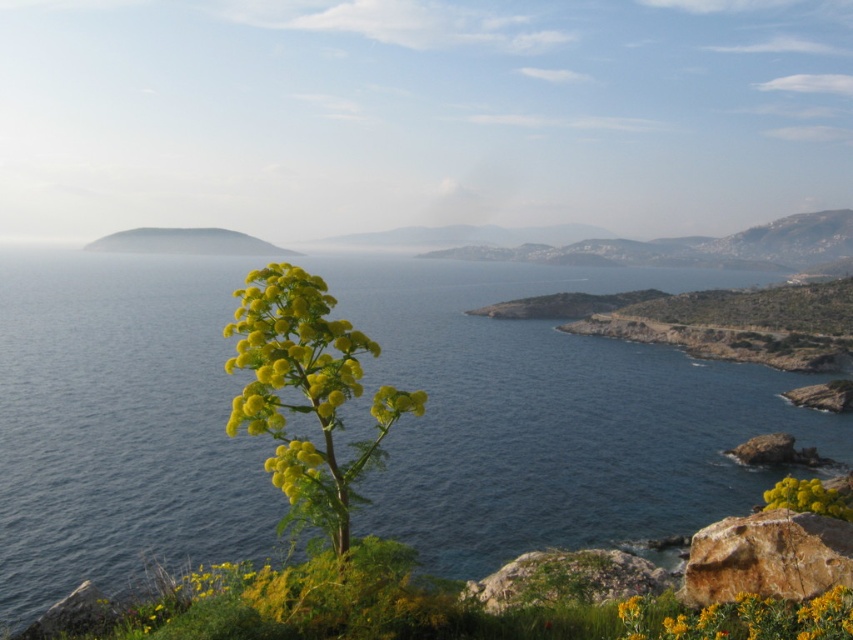
You are a botanist examining the coastal landscape. You need to determine which object occupies more space in the image between the yellow fluffy plant at center and the brown rough rock at lower right. Based on their sizes, which one would you say is larger?

The yellow fluffy plant at center is bigger than the brown rough rock at lower right, so the yellow fluffy plant at center occupies more space in the image.

You are planning to place a small garden statue between the brown rough rock at lower right and the yellow matte flower at lower right in the coastal landscape. The statue requires a minimum of 12 meters of space between the two objects to be placed safely. Based on the scene description, can the statue be placed there?

The distance between the brown rough rock at lower right and the yellow matte flower at lower right is 10.62 meters, which is less than the required 12 meters. Therefore, the statue cannot be placed there safely.